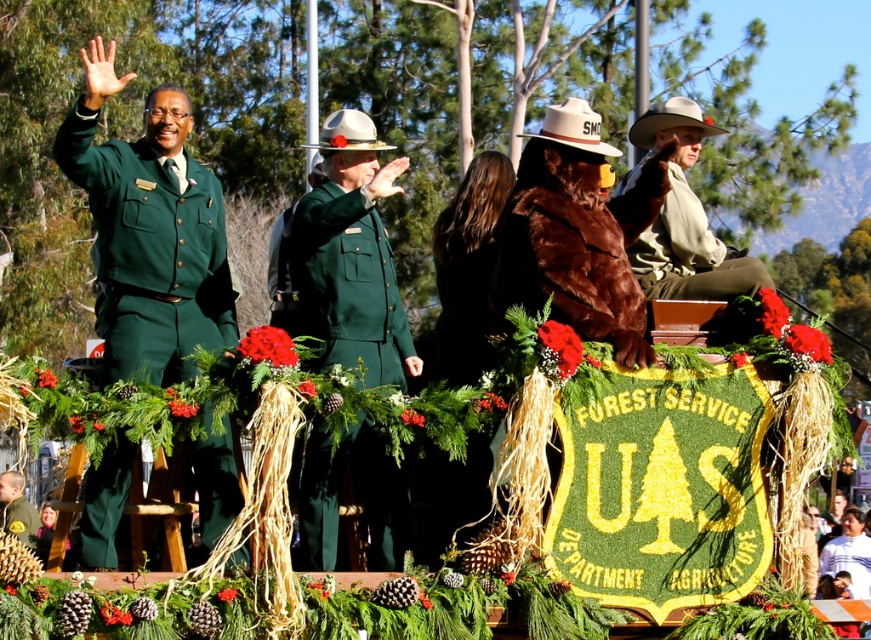
You are a photographer at the parade. You want to take a photo that includes both the green matte uniform at center and the brown furry bear at center. Based on their positions, which one will appear closer to the camera in the photo?

The green matte uniform at center will appear closer to the camera because the brown furry bear at center is behind it.

Where is the green matte uniform at center located in the image?

The green matte uniform at center is located at point (348, 284).

You are a photographer trying to capture a clear shot of the green matte uniform at left and the brown furry bear at center. Which object should you focus on first if you want to ensure both are in focus without adjusting your camera settings?

The green matte uniform at left is below the brown furry bear at center, so focusing on the brown furry bear at center first would allow the green matte uniform at left to be in focus as well since it is closer to the camera.